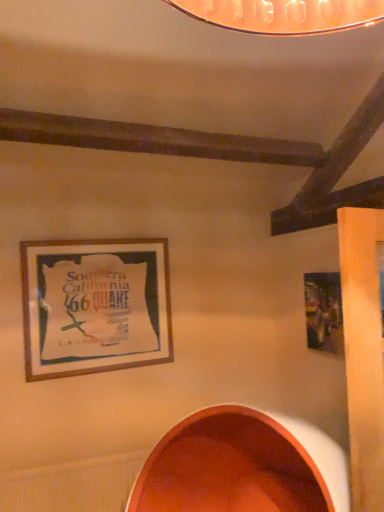
Question: Does wooden frame at upper left, the first picture frame positioned from the left, have a greater height compared to metallic silver picture frame at right, positioned as the 1th picture frame in right-to-left order?

Choices:
 (A) yes
 (B) no

Answer: (A)

Question: From the image's perspective, would you say wooden frame at upper left, placed as the second picture frame when sorted from right to left, is shown under metallic silver picture frame at right, acting as the second picture frame starting from the left?

Choices:
 (A) no
 (B) yes

Answer: (A)

Question: Is there a large distance between wooden frame at upper left, the first picture frame positioned from the left, and metallic silver picture frame at right, acting as the second picture frame starting from the left?

Choices:
 (A) yes
 (B) no

Answer: (A)

Question: Does wooden frame at upper left, the first picture frame positioned from the left, have a lesser height compared to metallic silver picture frame at right, acting as the second picture frame starting from the left?

Choices:
 (A) yes
 (B) no

Answer: (B)

Question: From a real-world perspective, is wooden frame at upper left, placed as the second picture frame when sorted from right to left, under metallic silver picture frame at right, positioned as the 1th picture frame in right-to-left order?

Choices:
 (A) no
 (B) yes

Answer: (A)

Question: Is wooden frame at upper left, placed as the second picture frame when sorted from right to left, behind metallic silver picture frame at right, acting as the second picture frame starting from the left?

Choices:
 (A) no
 (B) yes

Answer: (B)

Question: Is wooden frame at upper left, placed as the second picture frame when sorted from right to left, at the back of matte orange bowl at lower center?

Choices:
 (A) no
 (B) yes

Answer: (A)

Question: From a real-world perspective, is matte orange bowl at lower center on wooden frame at upper left, the first picture frame positioned from the left?

Choices:
 (A) yes
 (B) no

Answer: (B)

Question: Considering the relative positions of matte orange bowl at lower center and wooden frame at upper left, the first picture frame positioned from the left, in the image provided, is matte orange bowl at lower center in front of wooden frame at upper left, the first picture frame positioned from the left,?

Choices:
 (A) no
 (B) yes

Answer: (B)

Question: From the image's perspective, is matte orange bowl at lower center over wooden frame at upper left, the first picture frame positioned from the left?

Choices:
 (A) no
 (B) yes

Answer: (A)

Question: Is matte orange bowl at lower center to the left of wooden frame at upper left, the first picture frame positioned from the left, from the viewer's perspective?

Choices:
 (A) no
 (B) yes

Answer: (A)

Question: Is matte orange bowl at lower center touching wooden frame at upper left, the first picture frame positioned from the left?

Choices:
 (A) no
 (B) yes

Answer: (A)

Question: From a real-world perspective, is metallic silver picture frame at right, positioned as the 1th picture frame in right-to-left order, beneath matte orange bowl at lower center?

Choices:
 (A) no
 (B) yes

Answer: (A)